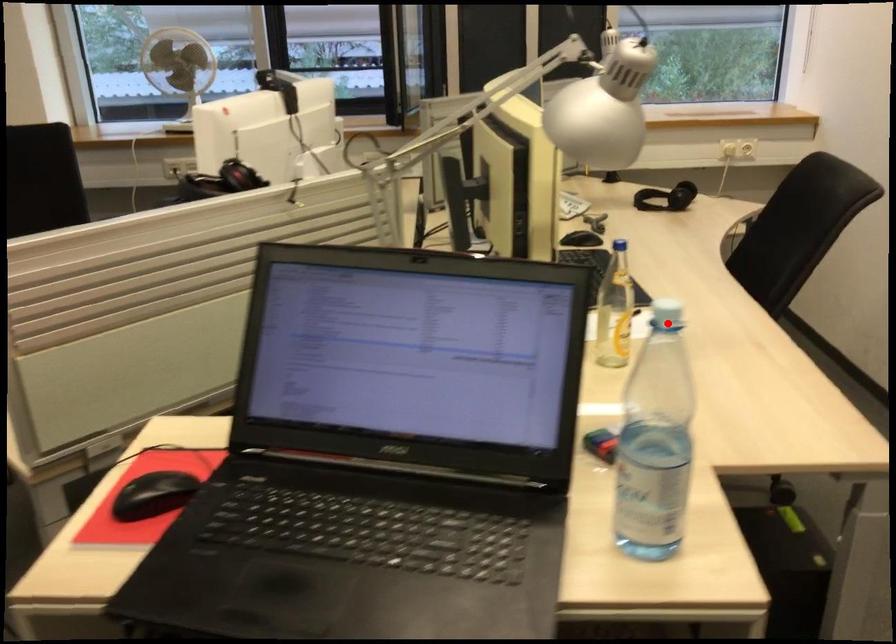
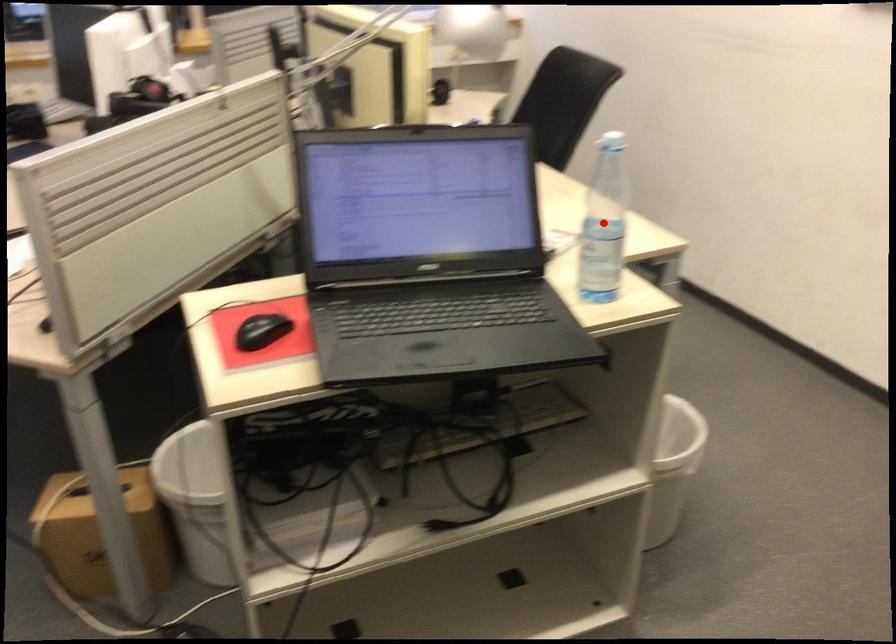
I am providing you with two images of the same scene from different viewpoints. A red point is marked on the first image and another point is marked on the second image. Does the point marked in image1 correspond to the same location as the one in image2?

No